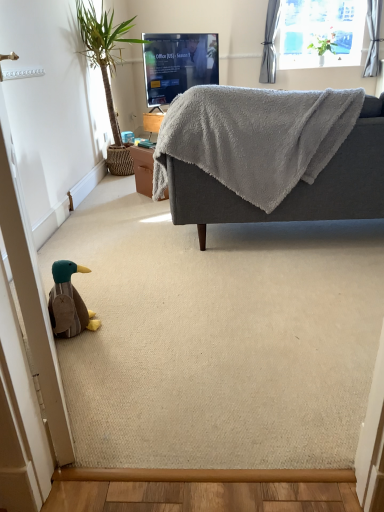
The width and height of the screenshot is (384, 512). In order to click on free space in front of brown plush duck at lower left in this screenshot , I will do `click(84, 349)`.